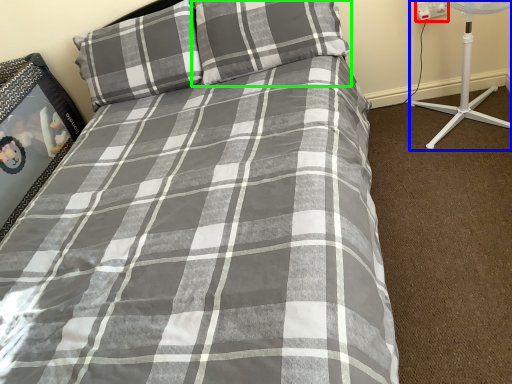
Question: Which object is positioned closest to electric outlet (highlighted by a red box)? Select from fan (highlighted by a blue box) and pillow (highlighted by a green box).

Choices:
 (A) fan
 (B) pillow

Answer: (A)